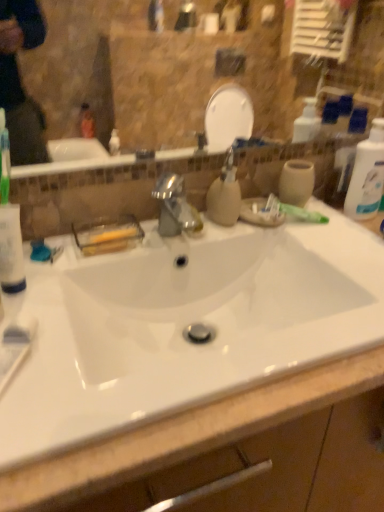
Question: Is white glossy sink at center shorter than white plastic bottle at right?

Choices:
 (A) no
 (B) yes

Answer: (A)

Question: From the image's perspective, is white glossy sink at center located above white plastic bottle at right?

Choices:
 (A) yes
 (B) no

Answer: (B)

Question: Can you confirm if white glossy sink at center is positioned to the left of white plastic bottle at right?

Choices:
 (A) yes
 (B) no

Answer: (A)

Question: Is white glossy sink at center thinner than white plastic bottle at right?

Choices:
 (A) yes
 (B) no

Answer: (B)

Question: Considering the relative sizes of white glossy sink at center and white plastic bottle at right in the image provided, is white glossy sink at center bigger than white plastic bottle at right?

Choices:
 (A) yes
 (B) no

Answer: (A)

Question: Is white plastic bottle at right inside white glossy sink at center?

Choices:
 (A) no
 (B) yes

Answer: (A)

Question: From the image's perspective, is matte beige soap dispenser at center below white glossy sink at center?

Choices:
 (A) yes
 (B) no

Answer: (B)

Question: Is there a large distance between matte beige soap dispenser at center and white glossy sink at center?

Choices:
 (A) no
 (B) yes

Answer: (A)

Question: Considering the relative sizes of matte beige soap dispenser at center and white glossy sink at center in the image provided, is matte beige soap dispenser at center thinner than white glossy sink at center?

Choices:
 (A) no
 (B) yes

Answer: (B)

Question: Is matte beige soap dispenser at center next to white glossy sink at center?

Choices:
 (A) no
 (B) yes

Answer: (A)

Question: Considering the relative sizes of matte beige soap dispenser at center and white glossy sink at center in the image provided, is matte beige soap dispenser at center taller than white glossy sink at center?

Choices:
 (A) no
 (B) yes

Answer: (A)

Question: Is matte beige soap dispenser at center shorter than white glossy sink at center?

Choices:
 (A) yes
 (B) no

Answer: (A)

Question: Does matte beige soap dispenser at center have a greater width compared to white plastic bottle at right?

Choices:
 (A) yes
 (B) no

Answer: (A)